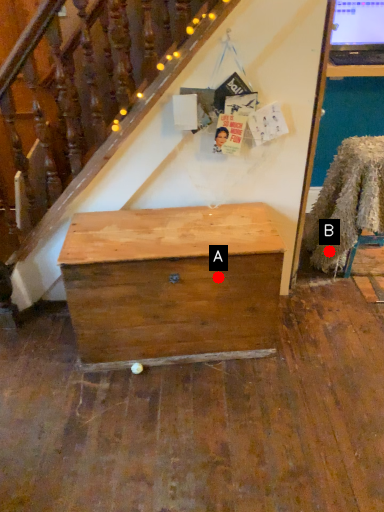
Question: Two points are circled on the image, labeled by A and B beside each circle. Which point is closer to the camera taking this photo?

Choices:
 (A) A is closer
 (B) B is closer

Answer: (A)